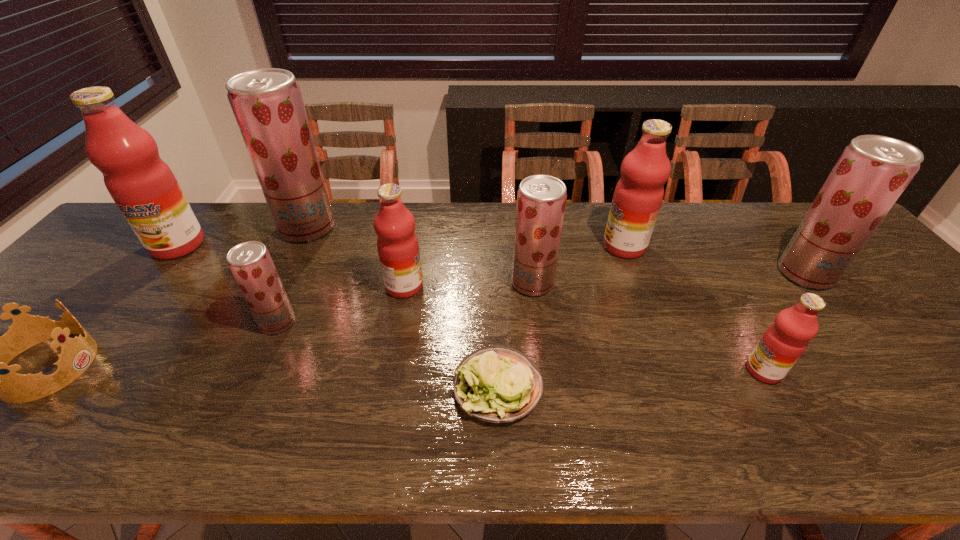
Locate which strawberry fruit juice is the third closest to the fourth fruit juice from right to left. Please provide its 2D coordinates. Your answer should be formatted as a tuple, i.e. [(x, y)], where the tuple contains the x and y coordinates of a point satisfying the conditions above.

[(872, 172)]

Locate an element on the screen. The height and width of the screenshot is (540, 960). strawberry fruit juice object that ranks as the fourth closest to the second nearest pink fruit juice is located at coordinates (872, 172).

Select which pink fruit juice appears as the fourth closest to the tiara. Please provide its 2D coordinates. Your answer should be formatted as a tuple, i.e. [(x, y)], where the tuple contains the x and y coordinates of a point satisfying the conditions above.

[(783, 343)]

The width and height of the screenshot is (960, 540). In order to click on pink fruit juice that is the second closest to the fifth object from left to right in this screenshot , I will do `click(143, 186)`.

I want to click on free spot that satisfies the following two spatial constraints: 1. on the label of the leftmost fruit juice; 2. on the right side of the rightmost fruit juice, so click(x=156, y=274).

In order to click on vacant area in the image that satisfies the following two spatial constraints: 1. on the front side of the lettuce; 2. on the right side of the smallest strawberry fruit juice in this screenshot , I will do `click(250, 387)`.

Locate an element on the screen. free point that satisfies the following two spatial constraints: 1. on the back side of the rightmost object; 2. on the right side of the seventh farthest fruit juice is located at coordinates (300, 274).